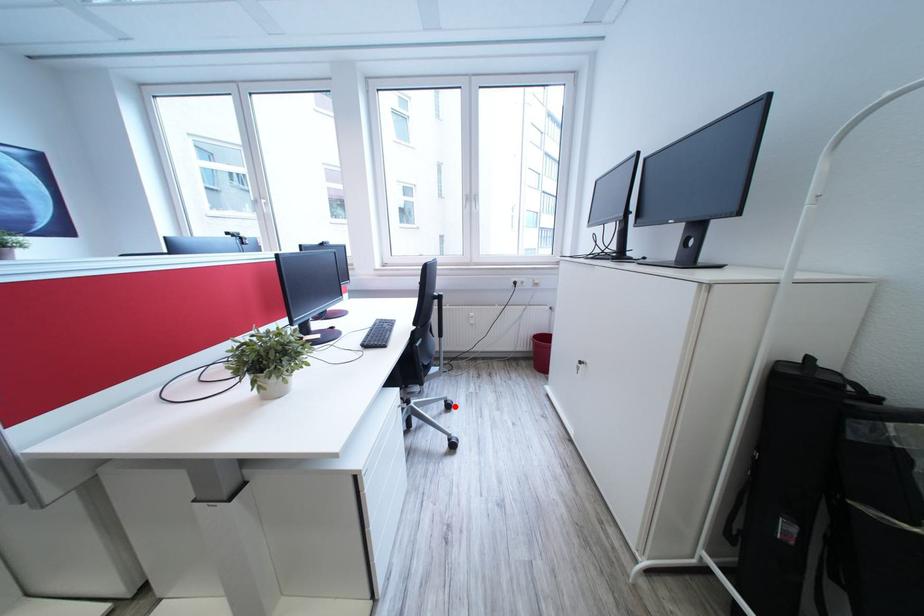
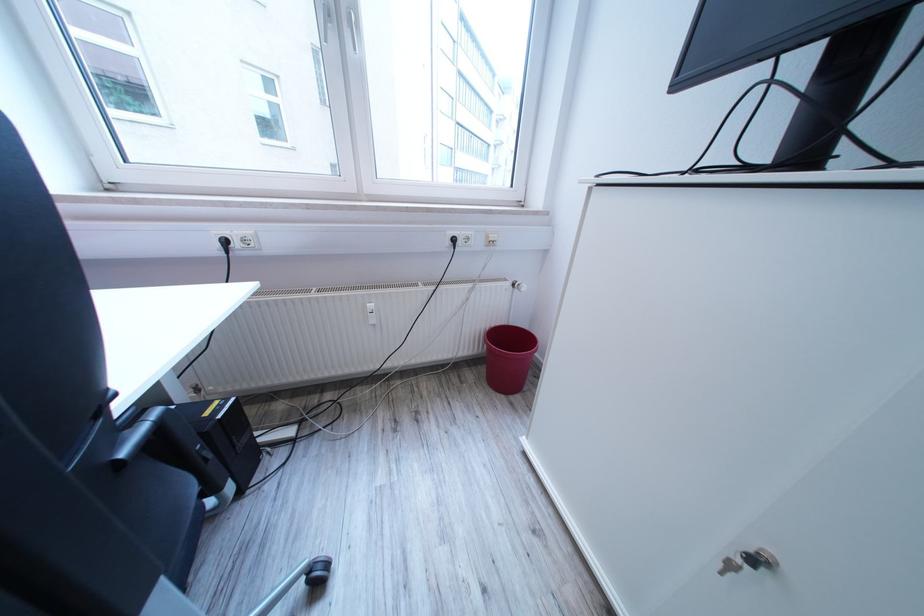
Question: I am providing you with two images of the same scene from different viewpoints. A red point is marked on the first image. Can you still see the location of the red point in image 2?

Choices:
 (A) Yes
 (B) No

Answer: (A)